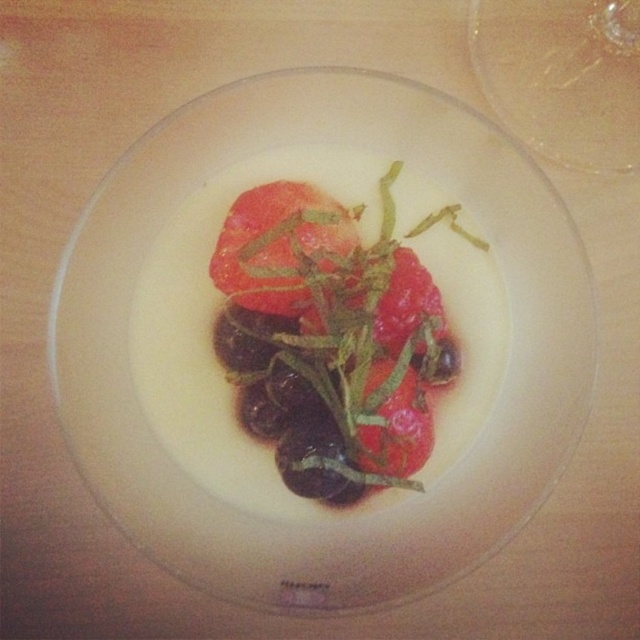
Looking at this image, you are a food stylist checking the height of ingredients in a dish. You have the matte white salad at center and the glossy red tomato at center. Which ingredient is taller?

The matte white salad at center is much taller than the glossy red tomato at center.

You are a food stylist arranging a dish. The white glossy platter at center is placed at point [381,509]. Where should you place the red roasted tomatoes to ensure they are positioned to the right of the platter?

The red roasted tomatoes should be placed to the right of the white glossy platter at center, which is located at point [381,509].